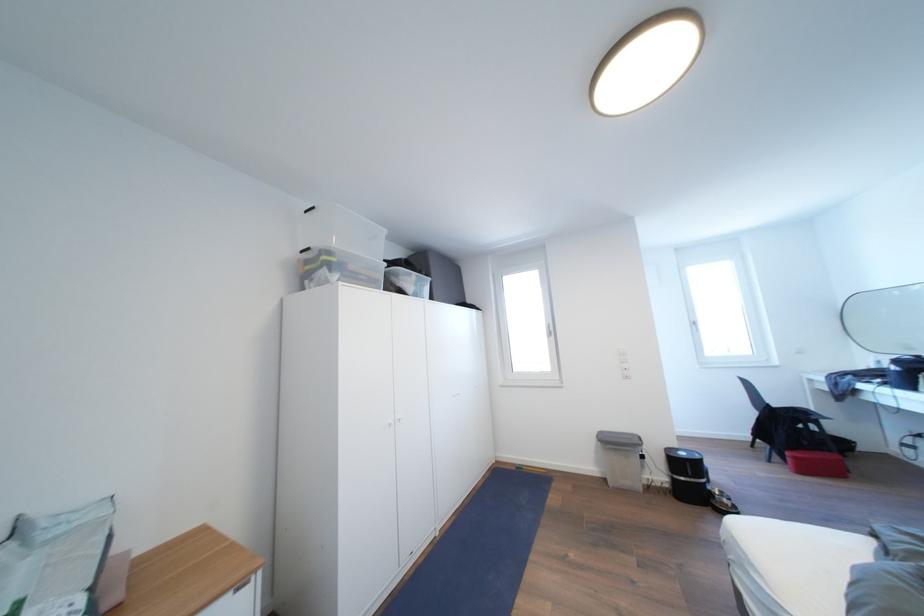
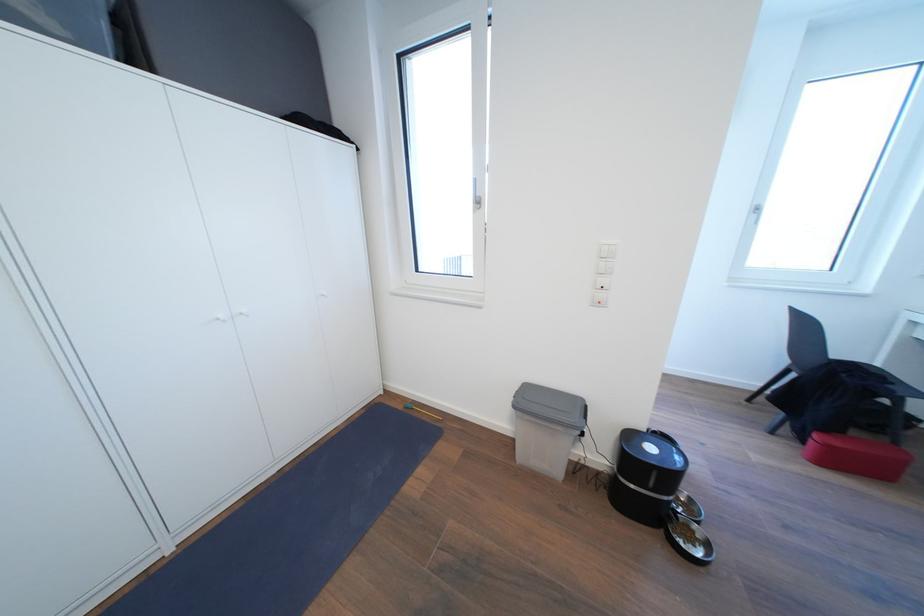
In a continuous first-person perspective shot, in which direction is the camera moving?

The movement direction of the cameraman is right, forward.